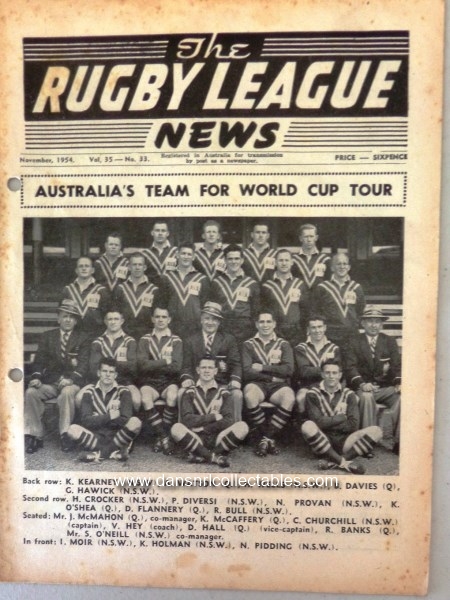
This screenshot has width=450, height=600. I want to click on picture, so click(x=324, y=401).